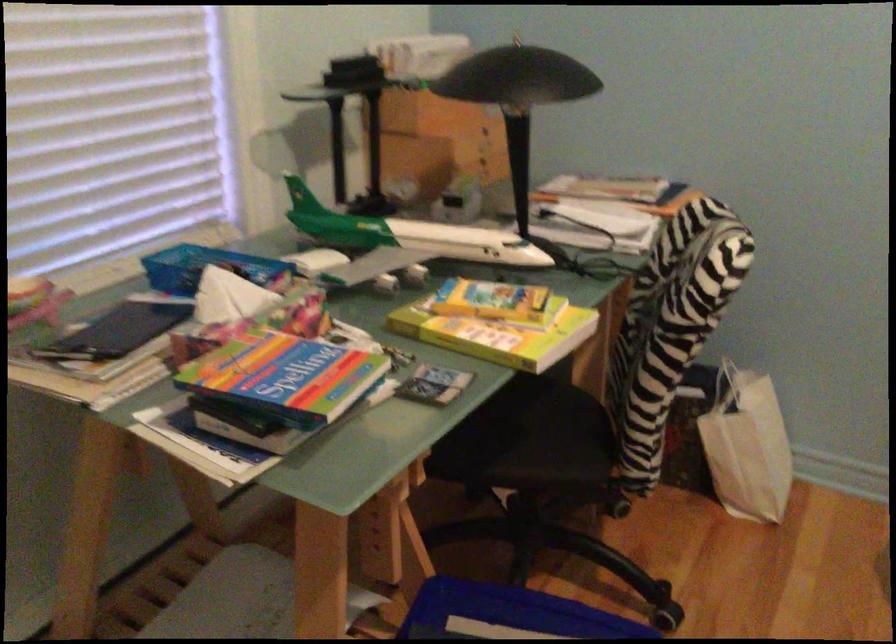
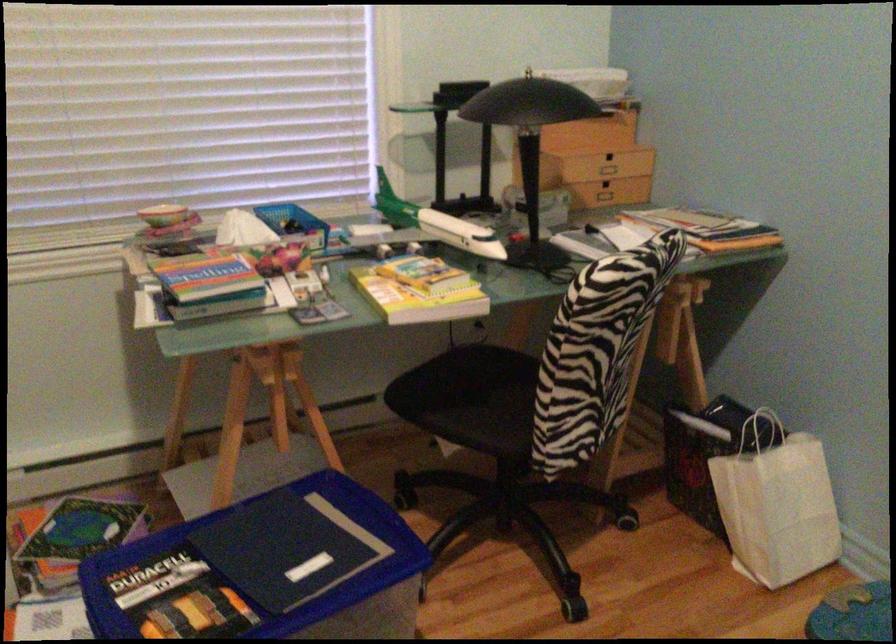
Where in the second image is the point corresponding to pixel 433 238 from the first image?

(438, 225)